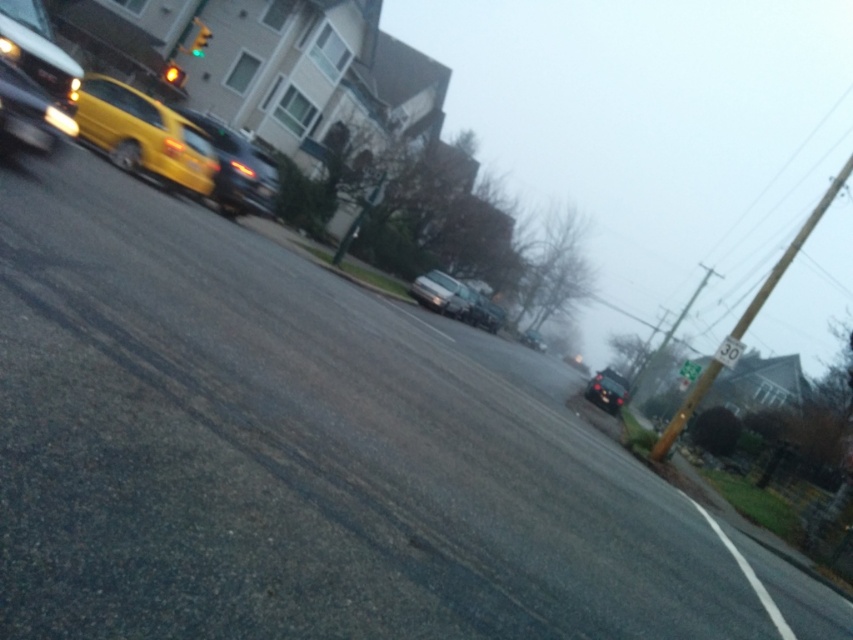
Which is behind, point (235, 136) or point (532, 340)?

Point (532, 340)

Describe the element at coordinates (236, 170) in the screenshot. I see `shiny blue sedan at center` at that location.

You are a GUI agent. You are given a task and a screenshot of the screen. Output one action in this format:
    pyautogui.click(x=<x>, y=<y>)
    Task: Click on the shiny blue sedan at center
    This screenshot has height=640, width=853.
    Given the screenshot: What is the action you would take?
    pyautogui.click(x=236, y=170)

Which of these two, metallic silver sedan at center or amber glass traffic light at upper left, stands taller?

With more height is metallic silver sedan at center.

Is point (485, 304) positioned in front of point (166, 83)?

No, it is behind (166, 83).

Locate an element on the screen. The image size is (853, 640). metallic silver sedan at center is located at coordinates (454, 300).

Is shiny blue sedan at center below shiny black sedan at center?

Incorrect, shiny blue sedan at center is not positioned below shiny black sedan at center.

The image size is (853, 640). What do you see at coordinates (236, 170) in the screenshot?
I see `shiny blue sedan at center` at bounding box center [236, 170].

The height and width of the screenshot is (640, 853). Identify the location of shiny blue sedan at center. (236, 170).